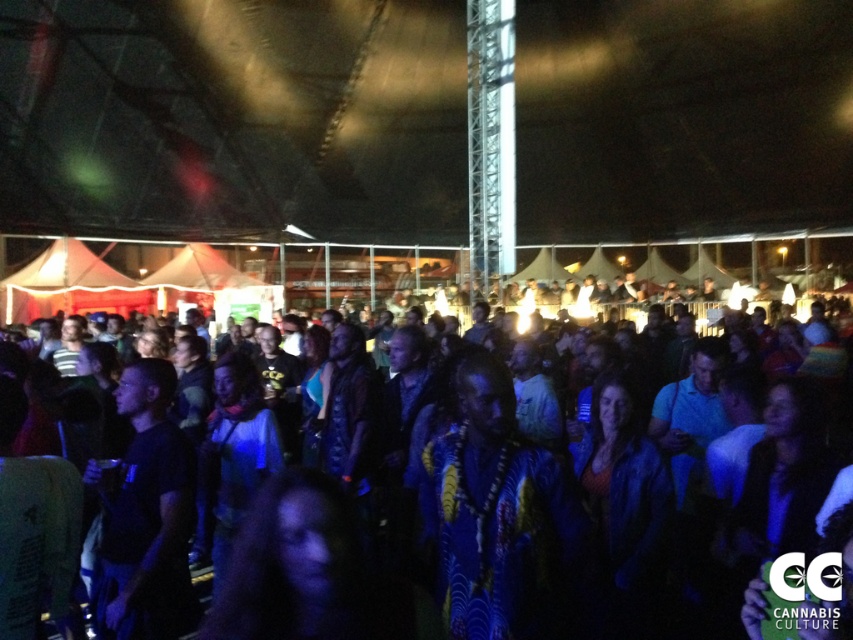
You are at the event and want to see the performance clearly. Considering the dark blue fabric crowd at center and the printed fabric shirt at center, which one is closer to you and might block your view?

The printed fabric shirt at center is closer to you than the dark blue fabric crowd at center, so it might block your view.

From the picture: You are at the event and want to see the performance clearly. There is a dark blue fabric crowd at center blocking your view. Can you see the performance better if you move behind the printed fabric shirt at center?

The printed fabric shirt at center is behind dark blue fabric crowd at center, so moving behind it would place you further away from the front, making it harder to see the performance clearly.